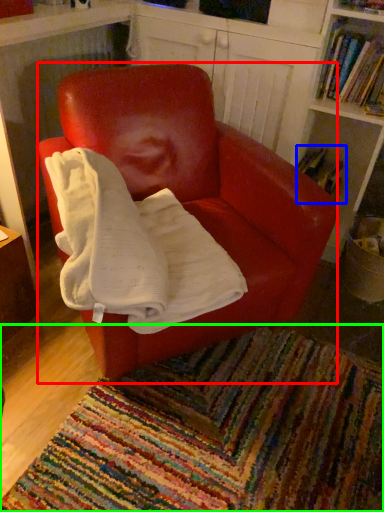
Question: Which is farther away from chair (highlighted by a red box)? book (highlighted by a blue box) or mat (highlighted by a green box)?

Choices:
 (A) book
 (B) mat

Answer: (A)